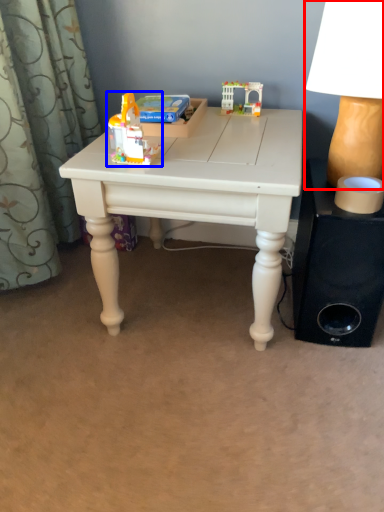
Question: Among these objects, which one is farthest to the camera, table lamp (highlighted by a red box) or toy (highlighted by a blue box)?

Choices:
 (A) table lamp
 (B) toy

Answer: (B)